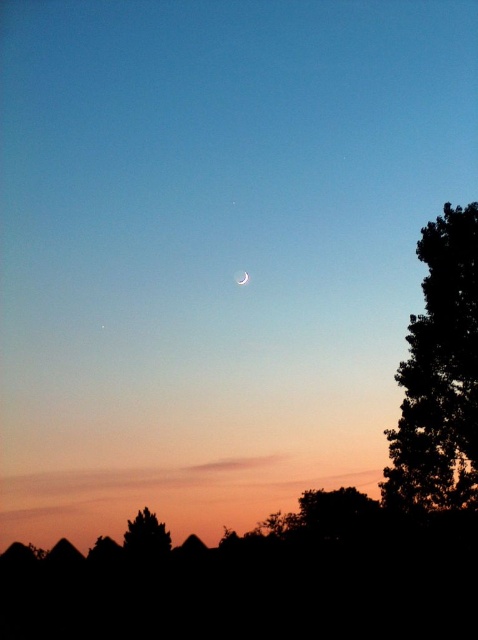
Question: Is silhouette tree at right closer to camera compared to silhouette tree at lower left?

Choices:
 (A) yes
 (B) no

Answer: (A)

Question: Is silhouette tree at right smaller than silhouette tree at lower left?

Choices:
 (A) yes
 (B) no

Answer: (B)

Question: Can you confirm if silhouette tree at right is smaller than white glossy moon at center?

Choices:
 (A) no
 (B) yes

Answer: (A)

Question: Which point is farther from the camera taking this photo?

Choices:
 (A) (473, 346)
 (B) (245, 280)
 (C) (144, 540)

Answer: (B)

Question: Based on their relative distances, which object is nearer to the white glossy moon at center?

Choices:
 (A) silhouette tree at lower left
 (B) silhouette tree at right

Answer: (A)

Question: Among these objects, which one is nearest to the camera?

Choices:
 (A) white glossy moon at center
 (B) silhouette tree at lower left

Answer: (B)